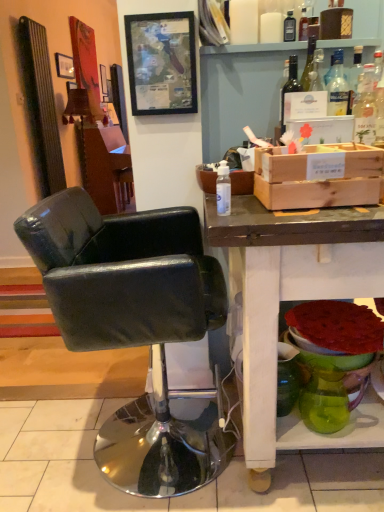
Question: Is wooden vanity at center spatially inside matte white desk at lower right, or outside of it?

Choices:
 (A) inside
 (B) outside

Answer: (B)

Question: In the image, is wooden vanity at center positioned in front of or behind matte white desk at lower right?

Choices:
 (A) front
 (B) behind

Answer: (B)

Question: Which of these objects is positioned closest to the black leather chair at center?

Choices:
 (A) wooden vanity at center
 (B) transparent plastic bottle at center, which is the first bottle in front-to-back order
 (C) matte white desk at lower right
 (D) wooden framed map at upper center, which is the second picture frame in back-to-front order
 (E) transparent glass bottle at upper center, the third bottle viewed from the front

Answer: (C)

Question: Which object is positioned farthest from the transparent glass bottle at upper center, positioned as the first bottle in back-to-front order?

Choices:
 (A) green glass vase at lower right
 (B) wooden vanity at center
 (C) wooden framed map at upper center, arranged as the 2th picture frame when viewed from the top
 (D) black leather chair at center
 (E) translucent glass bottle at upper right, the 2th bottle in the back-to-front sequence

Answer: (B)